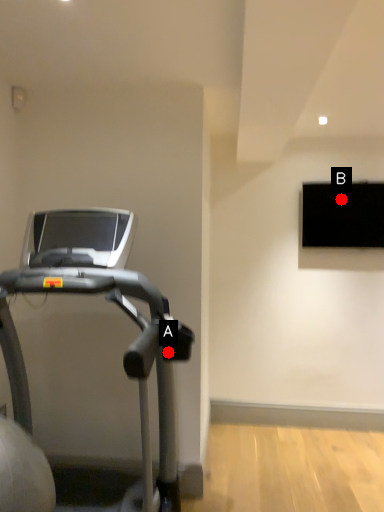
Question: Two points are circled on the image, labeled by A and B beside each circle. Which point is further to the camera?

Choices:
 (A) A is further
 (B) B is further

Answer: (B)